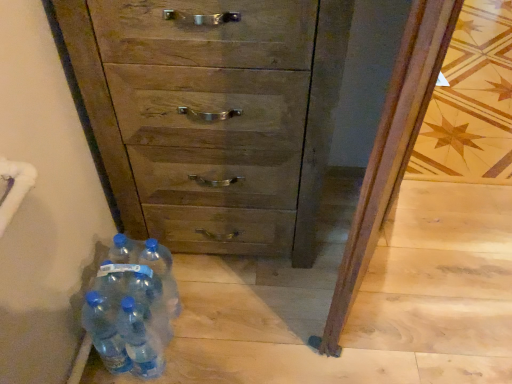
In order to click on vacant area that is situated to the right of blue plastic bottles at lower left, the 4th bottle in the right-to-left sequence in this screenshot , I will do `click(201, 333)`.